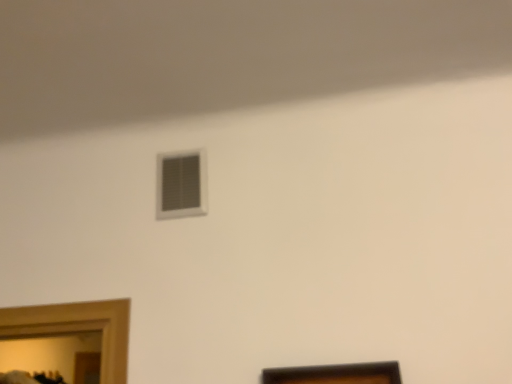
The image size is (512, 384). What do you see at coordinates (181, 185) in the screenshot? I see `white plastic vent at upper center` at bounding box center [181, 185].

Identify the location of white plastic vent at upper center. (181, 185).

Identify the location of brown wooden picture frame at lower center. The width and height of the screenshot is (512, 384). (335, 374).

Describe the element at coordinates (335, 374) in the screenshot. I see `brown wooden picture frame at lower center` at that location.

The image size is (512, 384). In order to click on white plastic vent at upper center in this screenshot , I will do `click(181, 185)`.

Considering the relative positions of white plastic vent at upper center and brown wooden picture frame at lower center in the image provided, is white plastic vent at upper center to the right of brown wooden picture frame at lower center from the viewer's perspective?

Incorrect, white plastic vent at upper center is not on the right side of brown wooden picture frame at lower center.

Which object is more forward, white plastic vent at upper center or brown wooden picture frame at lower center?

brown wooden picture frame at lower center is more forward.

Is point (192, 197) positioned in front of point (279, 376)?

No, it is behind (279, 376).

From the image's perspective, does white plastic vent at upper center appear higher than brown wooden picture frame at lower center?

Yes.

Looking at this image, from a real-world perspective, is white plastic vent at upper center positioned under brown wooden picture frame at lower center based on gravity?

No.

Considering the sizes of objects white plastic vent at upper center and brown wooden picture frame at lower center in the image provided, who is wider, white plastic vent at upper center or brown wooden picture frame at lower center?

brown wooden picture frame at lower center.

Considering the sizes of white plastic vent at upper center and brown wooden picture frame at lower center in the image, is white plastic vent at upper center taller or shorter than brown wooden picture frame at lower center?

Clearly, white plastic vent at upper center is shorter compared to brown wooden picture frame at lower center.

Who is smaller, white plastic vent at upper center or brown wooden picture frame at lower center?

With smaller size is white plastic vent at upper center.

Would you say white plastic vent at upper center is outside brown wooden picture frame at lower center?

Yes, white plastic vent at upper center is outside of brown wooden picture frame at lower center.

Is white plastic vent at upper center not near brown wooden picture frame at lower center?

white plastic vent at upper center is actually quite close to brown wooden picture frame at lower center.

Consider the image. Is white plastic vent at upper center aimed at brown wooden picture frame at lower center?

No, white plastic vent at upper center does not turn towards brown wooden picture frame at lower center.

How different are the orientations of white plastic vent at upper center and brown wooden picture frame at lower center in degrees?

They differ by 0.529 degrees in their facing directions.

Find the location of a particular element. The height and width of the screenshot is (384, 512). picture frame below the white plastic vent at upper center (from a real-world perspective) is located at coordinates (335, 374).

Which is more to the right, brown wooden picture frame at lower center or white plastic vent at upper center?

Positioned to the right is brown wooden picture frame at lower center.

Which object is closer to the camera taking this photo, brown wooden picture frame at lower center or white plastic vent at upper center?

brown wooden picture frame at lower center is closer to the camera.

Between point (350, 370) and point (203, 186), which one is positioned behind?

The point (203, 186) is farther from the camera.

From the image's perspective, is brown wooden picture frame at lower center above white plastic vent at upper center?

No, from the image's perspective, brown wooden picture frame at lower center is not on top of white plastic vent at upper center.

From a real-world perspective, is brown wooden picture frame at lower center physically below white plastic vent at upper center?

Correct, in the physical world, brown wooden picture frame at lower center is lower than white plastic vent at upper center.

Is brown wooden picture frame at lower center thinner than white plastic vent at upper center?

Incorrect, the width of brown wooden picture frame at lower center is not less than that of white plastic vent at upper center.

Can you confirm if brown wooden picture frame at lower center is taller than white plastic vent at upper center?

Yes.

Based on their sizes in the image, would you say brown wooden picture frame at lower center is bigger or smaller than white plastic vent at upper center?

brown wooden picture frame at lower center is bigger than white plastic vent at upper center.

Would you say white plastic vent at upper center is part of brown wooden picture frame at lower center's contents?

Actually, white plastic vent at upper center is outside brown wooden picture frame at lower center.

Is brown wooden picture frame at lower center not close to white plastic vent at upper center?

That's not correct — brown wooden picture frame at lower center is a little close to white plastic vent at upper center.

Is brown wooden picture frame at lower center aimed at white plastic vent at upper center?

No.

How many degrees apart are the facing directions of brown wooden picture frame at lower center and white plastic vent at upper center?

They differ by 0.529 degrees in their facing directions.

Locate an element on the screen. The height and width of the screenshot is (384, 512). window behind the brown wooden picture frame at lower center is located at coordinates (181, 185).

The width and height of the screenshot is (512, 384). I want to click on window lying behind the brown wooden picture frame at lower center, so click(181, 185).

Locate an element on the screen. This screenshot has height=384, width=512. picture frame below the white plastic vent at upper center (from a real-world perspective) is located at coordinates (335, 374).